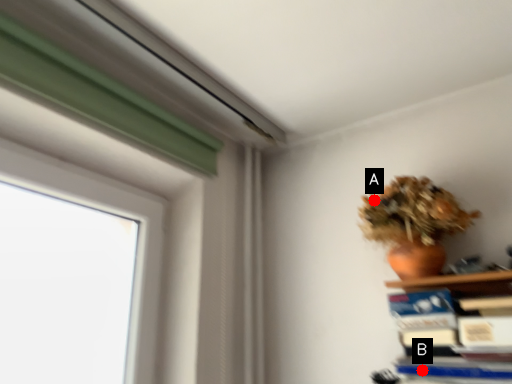
Question: Two points are circled on the image, labeled by A and B beside each circle. Which point is closer to the camera?

Choices:
 (A) A is closer
 (B) B is closer

Answer: (B)